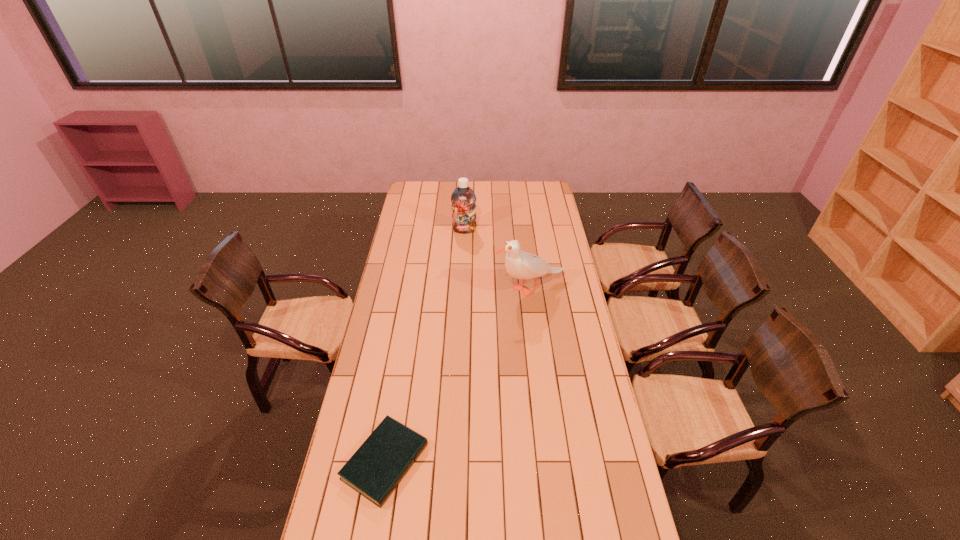
Where is `the second object from left to right`? the second object from left to right is located at coordinates (463, 198).

This screenshot has width=960, height=540. Identify the location of shampoo. (463, 198).

Locate an element on the screen. This screenshot has width=960, height=540. the rightmost object is located at coordinates (521, 265).

Locate an element on the screen. This screenshot has width=960, height=540. gull is located at coordinates (521, 265).

Image resolution: width=960 pixels, height=540 pixels. I want to click on the leftmost object, so click(376, 468).

Find the location of a particular element. This screenshot has width=960, height=540. the nearest object is located at coordinates (376, 468).

Locate an element on the screen. The height and width of the screenshot is (540, 960). vacant space located 0.190m on the front label of the shampoo is located at coordinates (464, 255).

What are the coordinates of `free space located 0.140m at the beak of the second nearest object` in the screenshot? It's located at (466, 289).

The height and width of the screenshot is (540, 960). What are the coordinates of `free space located at the beak of the second nearest object` in the screenshot? It's located at (425, 289).

The height and width of the screenshot is (540, 960). Identify the location of free location located at the beak of the second nearest object. click(x=459, y=289).